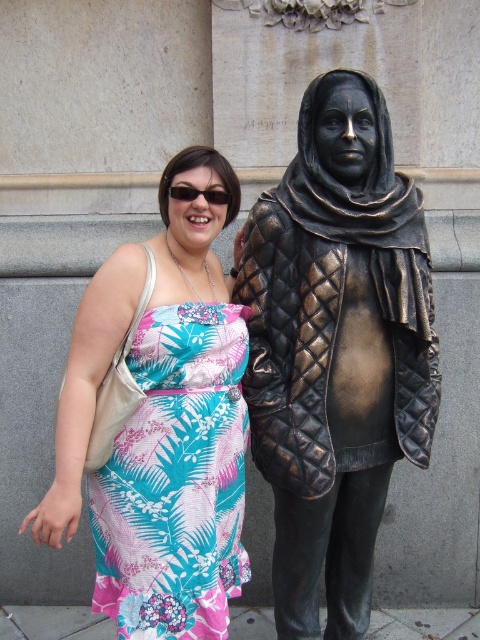
Question: Is the position of bronze quilted jacket at right less distant than that of floral print fabric dress at center?

Choices:
 (A) yes
 (B) no

Answer: (B)

Question: Which object is farther from the camera taking this photo?

Choices:
 (A) bronze quilted jacket at right
 (B) printed fabric dress at center

Answer: (A)

Question: Which point is closer to the camera?

Choices:
 (A) floral print fabric dress at center
 (B) bronze quilted jacket at right

Answer: (A)

Question: Does printed fabric dress at center appear under floral print fabric dress at center?

Choices:
 (A) no
 (B) yes

Answer: (A)

Question: Among these points, which one is nearest to the camera?

Choices:
 (A) (180, 195)
 (B) (163, 630)

Answer: (B)

Question: Is bronze quilted jacket at right to the right of printed fabric dress at center from the viewer's perspective?

Choices:
 (A) yes
 (B) no

Answer: (A)